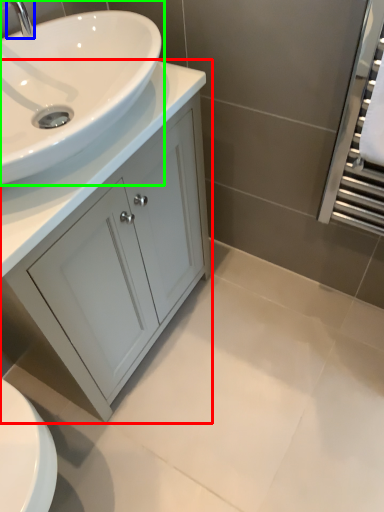
Question: Based on their relative distances, which object is nearer to bathroom cabinet (highlighted by a red box)? Choose from tap (highlighted by a blue box) and sink (highlighted by a green box).

Choices:
 (A) tap
 (B) sink

Answer: (B)